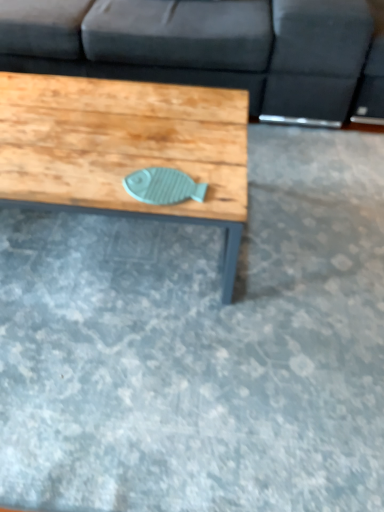
Question: Is wooden fish at center to the left or to the right of dark gray fabric couch at upper center in the image?

Choices:
 (A) left
 (B) right

Answer: (A)

Question: Based on their sizes in the image, would you say wooden fish at center is bigger or smaller than dark gray fabric couch at upper center?

Choices:
 (A) big
 (B) small

Answer: (B)

Question: Is wooden fish at center in front of or behind dark gray fabric couch at upper center in the image?

Choices:
 (A) behind
 (B) front

Answer: (B)

Question: From a real-world perspective, is dark gray fabric couch at upper center positioned above or below wooden fish at center?

Choices:
 (A) above
 (B) below

Answer: (A)

Question: In the image, is dark gray fabric couch at upper center positioned in front of or behind wooden fish at center?

Choices:
 (A) behind
 (B) front

Answer: (A)

Question: Do you think dark gray fabric couch at upper center is within wooden fish at center, or outside of it?

Choices:
 (A) inside
 (B) outside

Answer: (B)

Question: Is dark gray fabric couch at upper center taller or shorter than wooden fish at center?

Choices:
 (A) short
 (B) tall

Answer: (B)